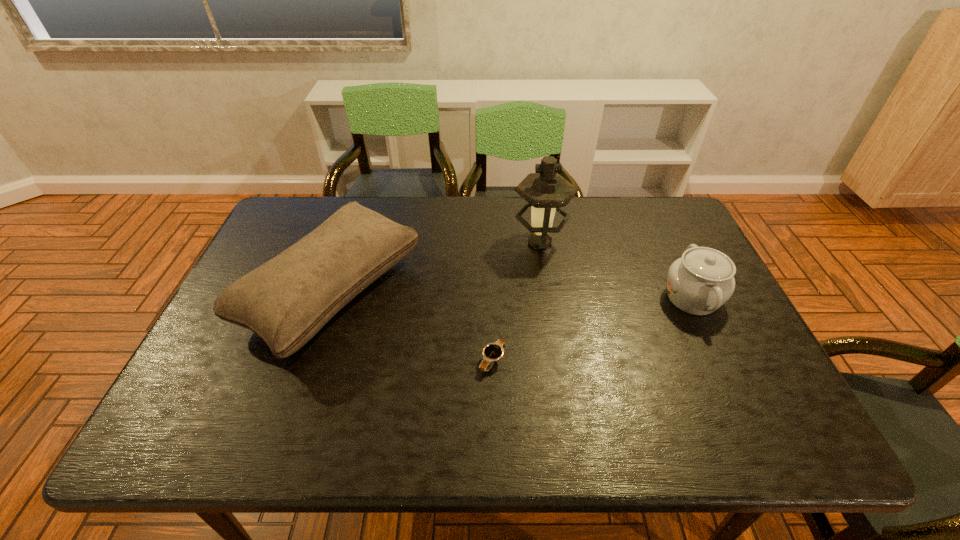
I want to click on the tallest object, so click(x=545, y=191).

Image resolution: width=960 pixels, height=540 pixels. I want to click on the third object from left to right, so coord(545,191).

Locate an element on the screen. Image resolution: width=960 pixels, height=540 pixels. the leftmost object is located at coordinates (286, 301).

Locate an element on the screen. This screenshot has width=960, height=540. the rightmost object is located at coordinates (702, 280).

At what (x,y) coordinates should I click in order to perform the action: click on the shortest object. Please return your answer as a coordinate pair (x, y). This screenshot has height=540, width=960. Looking at the image, I should click on (492, 352).

This screenshot has height=540, width=960. What are the coordinates of `the second object from left to right` in the screenshot? It's located at (492, 352).

What are the coordinates of `free spot located 0.180m on the right of the tallest object` in the screenshot? It's located at click(627, 242).

This screenshot has width=960, height=540. In order to click on free space located on the front of the leftmost object in this screenshot , I will do `click(291, 417)`.

Identify the location of blank area located on the back of the rightmost object. (648, 205).

Find the location of `free space located 0.210m on the left of the shortest object`. free space located 0.210m on the left of the shortest object is located at coordinates (391, 360).